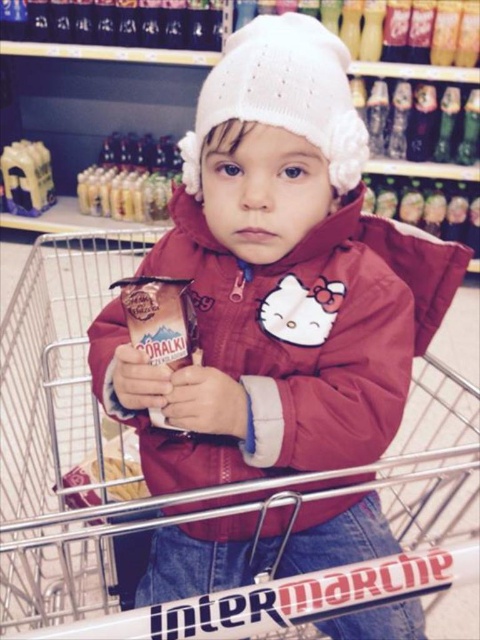
Question: Does matte red jacket at center appear on the right side of white knitted hat at upper center?

Choices:
 (A) yes
 (B) no

Answer: (B)

Question: Does metallic silver shopping cart at center appear over white knitted hat at upper center?

Choices:
 (A) no
 (B) yes

Answer: (A)

Question: Which point is farther to the camera?

Choices:
 (A) metallic silver shopping cart at center
 (B) matte red jacket at center

Answer: (B)

Question: Can you confirm if metallic silver shopping cart at center is thinner than white knitted hat at upper center?

Choices:
 (A) yes
 (B) no

Answer: (B)

Question: Which of the following is the closest to the observer?

Choices:
 (A) (84, 596)
 (B) (291, 106)

Answer: (B)

Question: Based on their relative distances, which object is nearer to the metallic silver shopping cart at center?

Choices:
 (A) white knitted hat at upper center
 (B) matte red jacket at center

Answer: (B)